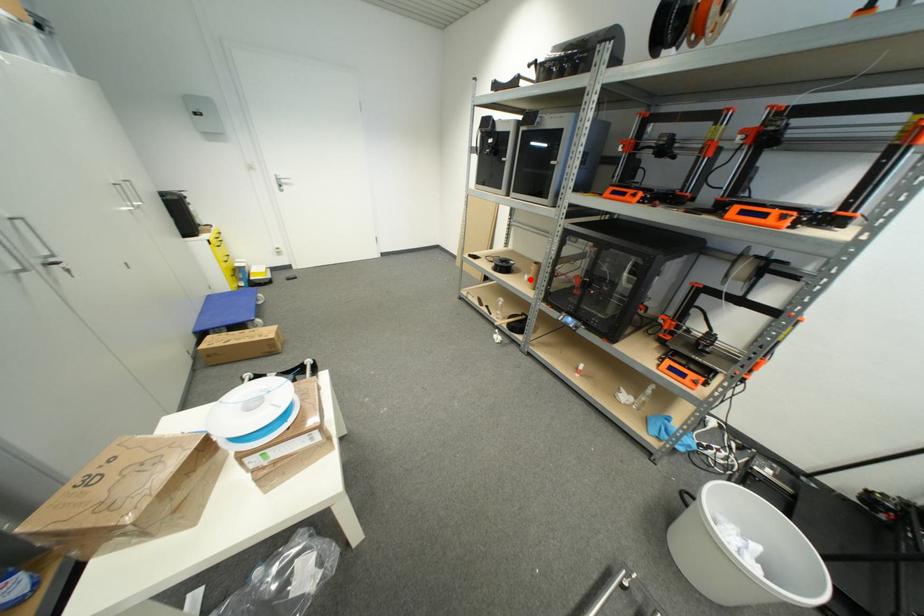
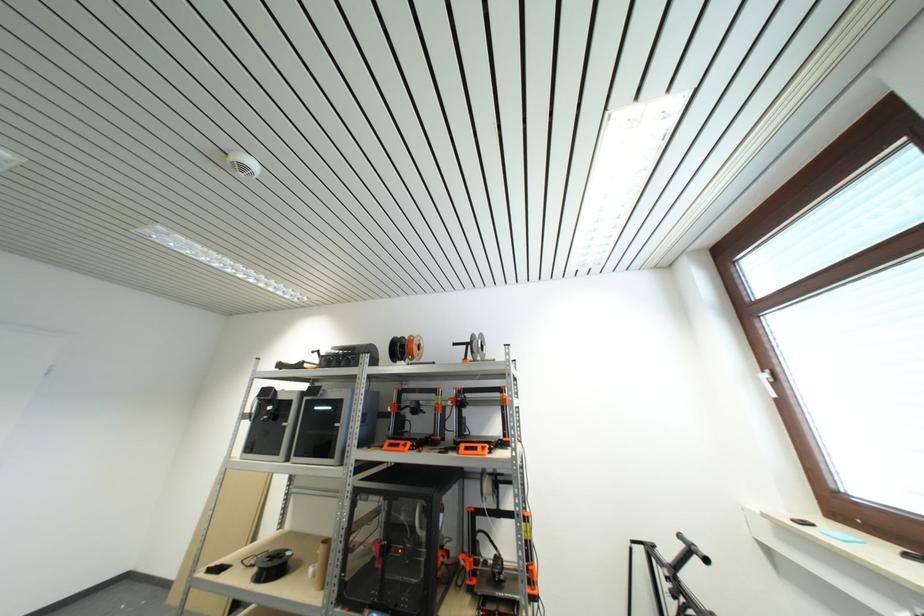
The point at the highlighted location is marked in the first image. Where is the corresponding point in the second image?

(314, 573)